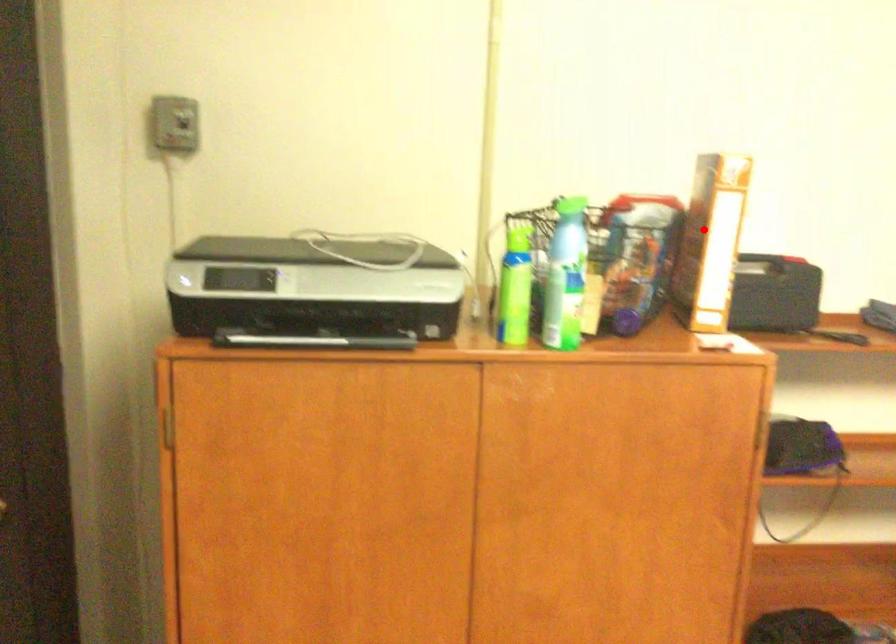
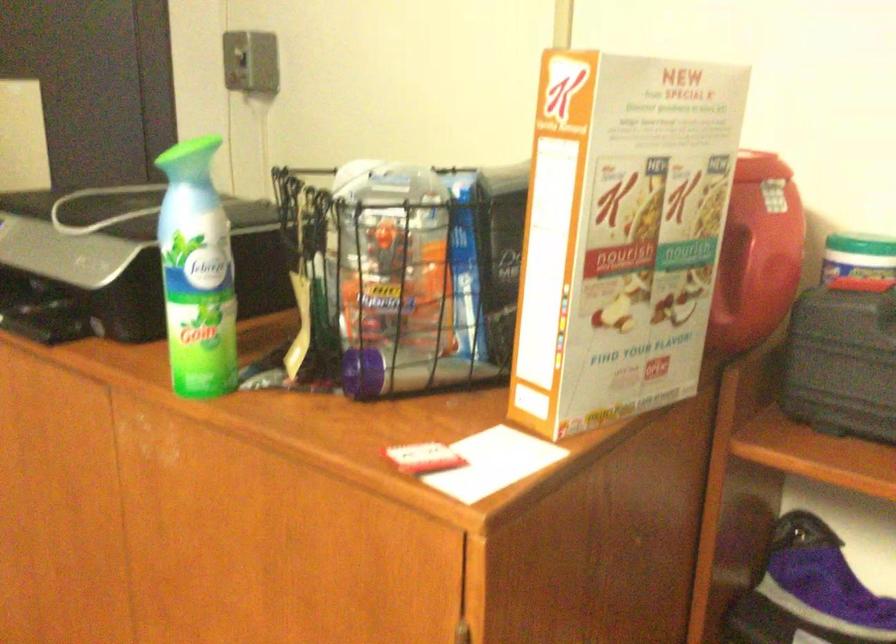
Question: I am providing you with two images of the same scene from different viewpoints. In image1, a red point is highlighted. Considering the same 3D point in image2, which of the following is correct?

Choices:
 (A) It is closer
 (B) It is farther

Answer: (A)